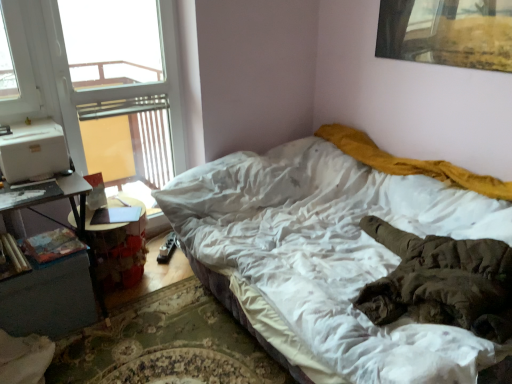
Question: Is wooden table at left positioned far away from dark gray wood nightstand at lower left?

Choices:
 (A) yes
 (B) no

Answer: (B)

Question: Is wooden table at left further to the viewer compared to dark gray wood nightstand at lower left?

Choices:
 (A) no
 (B) yes

Answer: (B)

Question: Considering the relative sizes of wooden table at left and dark gray wood nightstand at lower left in the image provided, is wooden table at left thinner than dark gray wood nightstand at lower left?

Choices:
 (A) yes
 (B) no

Answer: (B)

Question: Could dark gray wood nightstand at lower left be considered to be inside wooden table at left?

Choices:
 (A) yes
 (B) no

Answer: (B)

Question: Is the position of wooden table at left less distant than that of dark gray wood nightstand at lower left?

Choices:
 (A) no
 (B) yes

Answer: (A)

Question: From the image's perspective, is wooden cylindrical at left, the first book from the left, above or below transparent glass window at upper left?

Choices:
 (A) below
 (B) above

Answer: (A)

Question: Considering the positions of wooden cylindrical at left, the first book from the left, and transparent glass window at upper left in the image, is wooden cylindrical at left, the first book from the left, wider or thinner than transparent glass window at upper left?

Choices:
 (A) thin
 (B) wide

Answer: (B)

Question: Is wooden cylindrical at left, the first book from the left, inside or outside of transparent glass window at upper left?

Choices:
 (A) outside
 (B) inside

Answer: (A)

Question: Visually, is wooden cylindrical at left, the first book from the left, positioned to the left or to the right of transparent glass window at upper left?

Choices:
 (A) right
 (B) left

Answer: (B)

Question: Is point (122, 92) positioned closer to the camera than point (61, 284)?

Choices:
 (A) closer
 (B) farther

Answer: (B)

Question: Is transparent glass window at upper left taller or shorter than dark gray wood nightstand at lower left?

Choices:
 (A) short
 (B) tall

Answer: (B)

Question: In terms of size, does transparent glass window at upper left appear bigger or smaller than dark gray wood nightstand at lower left?

Choices:
 (A) big
 (B) small

Answer: (A)

Question: Based on their positions, is transparent glass window at upper left located to the left or right of dark gray wood nightstand at lower left?

Choices:
 (A) left
 (B) right

Answer: (B)

Question: Is point tap(357, 192) closer or farther from the camera than point tap(41, 238)?

Choices:
 (A) closer
 (B) farther

Answer: (B)

Question: Based on their sizes in the image, would you say white soft bed at center is bigger or smaller than hardcover book at lower left, acting as the second book starting from the left?

Choices:
 (A) big
 (B) small

Answer: (A)